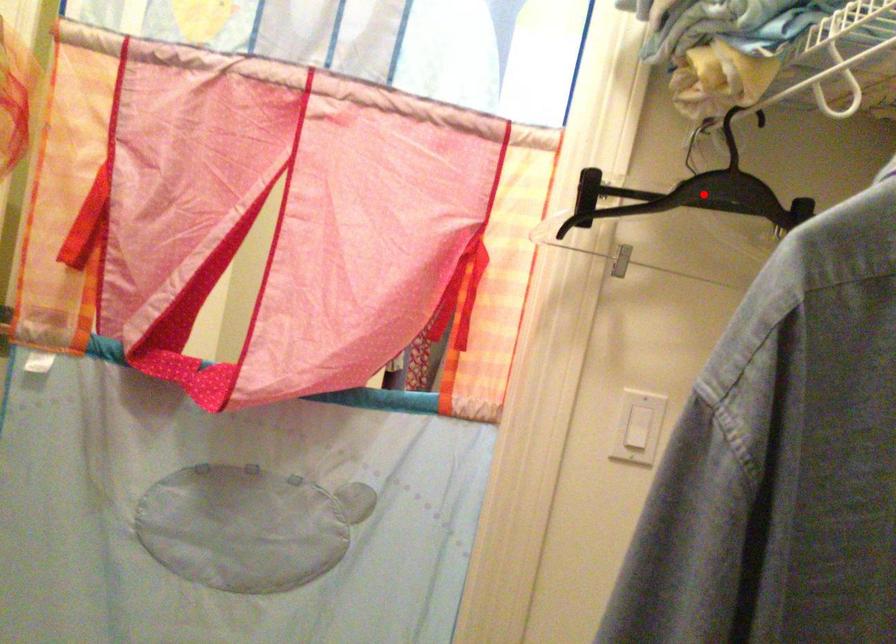
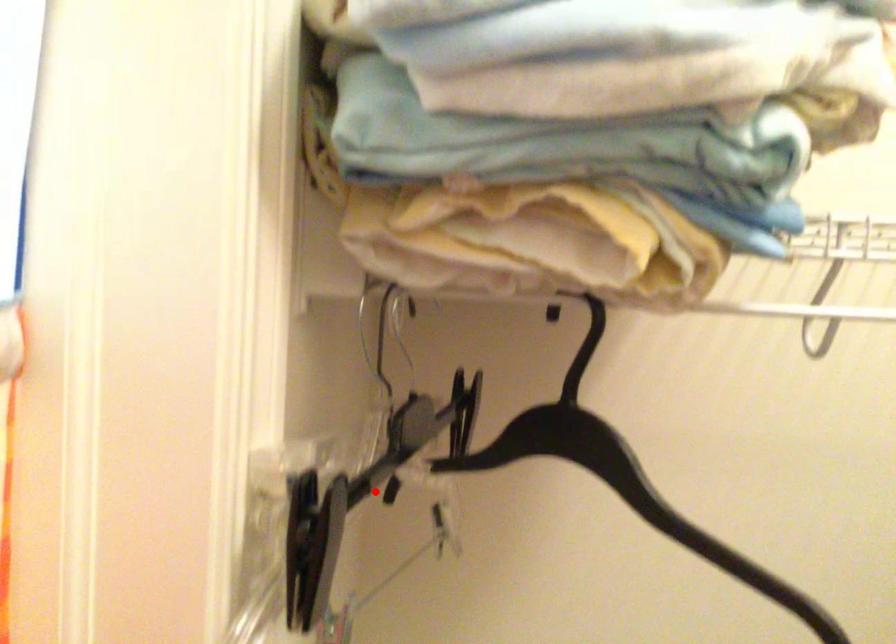
I am providing you with two images of the same scene from different viewpoints. A red point is marked on the first image and another point is marked on the second image. Do the highlighted points in image1 and image2 indicate the same real-world spot?

No